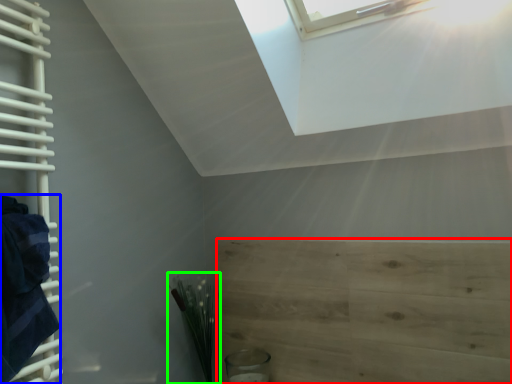
Question: Which object is the closest to the plywood (highlighted by a red box)? Choose among these: blanket (highlighted by a blue box) or plant (highlighted by a green box).

Choices:
 (A) blanket
 (B) plant

Answer: (B)